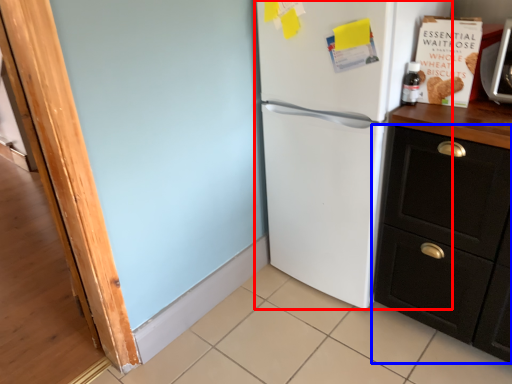
Question: Which point is closer to the camera, refrigerator (highlighted by a red box) or cabinetry (highlighted by a blue box)?

Choices:
 (A) refrigerator
 (B) cabinetry

Answer: (B)